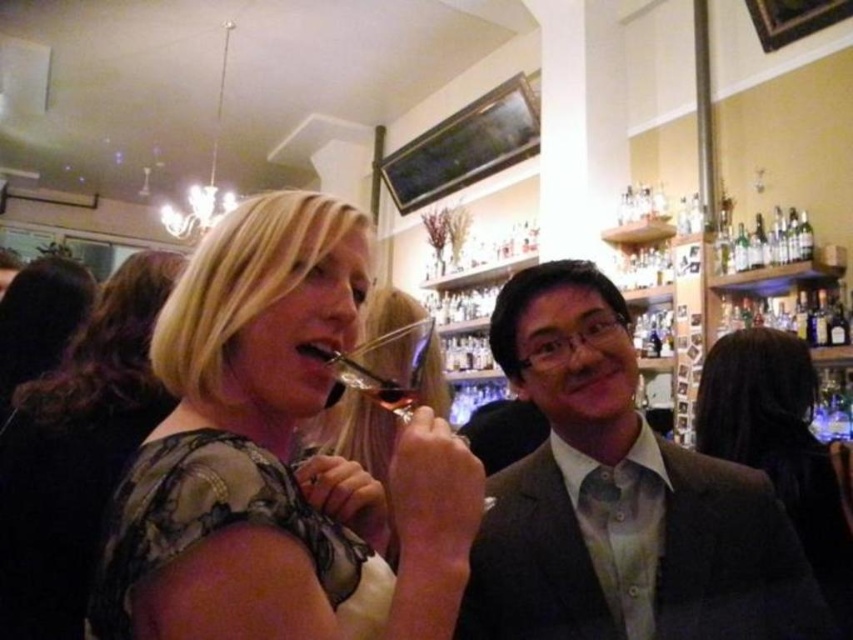
Question: Can you confirm if matte gray suit at center is wider than transparent glass wine glass at center?

Choices:
 (A) no
 (B) yes

Answer: (B)

Question: Which of the following is the farthest from the observer?

Choices:
 (A) camouflage-patterned dress at center
 (B) transparent glass wine glass at center

Answer: (A)

Question: Which point is farther to the camera?

Choices:
 (A) camouflage-patterned dress at center
 (B) matte floral dress at center
 (C) dark brown hair at center

Answer: (C)

Question: Observing the image, what is the correct spatial positioning of matte gray suit at center in reference to dark brown hair at center?

Choices:
 (A) left
 (B) right

Answer: (A)

Question: Which of these objects is positioned closest to the matte black dress at center?

Choices:
 (A) matte gray suit at center
 (B) transparent glass wine glass at center
 (C) camouflage-patterned dress at center
 (D) dark brown hair at center

Answer: (B)

Question: Does matte black dress at center lie behind camouflage-patterned dress at center?

Choices:
 (A) no
 (B) yes

Answer: (A)